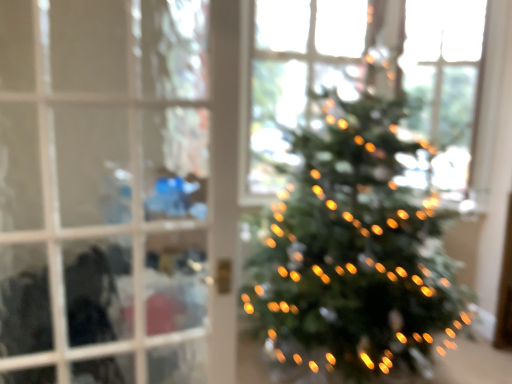
The height and width of the screenshot is (384, 512). In order to click on clear glass door at left in this screenshot , I will do click(x=116, y=192).

What do you see at coordinates (116, 192) in the screenshot?
I see `clear glass door at left` at bounding box center [116, 192].

The height and width of the screenshot is (384, 512). I want to click on clear glass door at left, so 116,192.